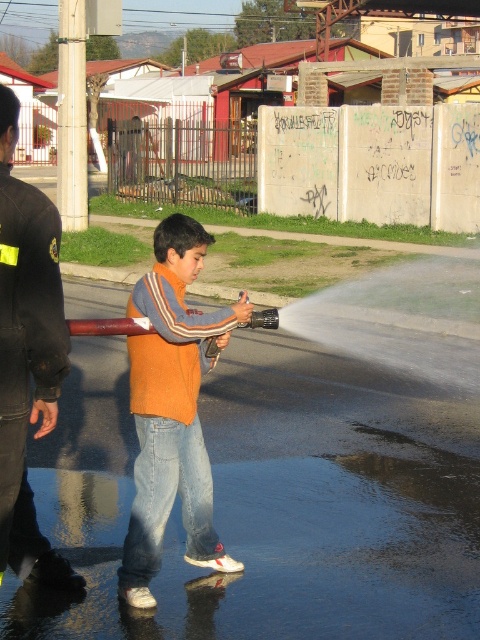
You are a delivery person trying to decide where to place a large package in the area shown. The orange fleece at center and the black leather jacket at left are already present. Based on their sizes, which object should you avoid placing the package near to ensure enough space?

The orange fleece at center occupies less space than the black leather jacket at left, so you should avoid placing the package near the orange fleece at center to ensure enough space since it has less room available.

You are standing in the residential area where the boy is spraying water with a hose. There is a point at coordinates point (155,486) that is 4.35 meters away from you. If you want to reach that point quickly, which direction should you move relative to the boy?

The point at coordinates point (155,486) is 4.35 meters from the viewer. Since the boy is spraying water on the wet street, you should move towards the boy to reach the point quickly as it is within a short distance.

You are a delivery person trying to find the correct address. You see an orange fleece at center and a black leather jacket at left. Which one is closer to the ground?

The orange fleece at center is below black leather jacket at left, so the orange fleece at center is closer to the ground.